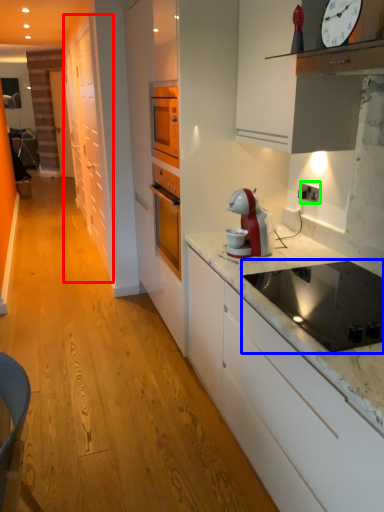
Question: Based on their relative distances, which object is nearer to cabinetry (highlighted by a red box)? Choose from kitchen appliance (highlighted by a blue box) and electric outlet (highlighted by a green box).

Choices:
 (A) kitchen appliance
 (B) electric outlet

Answer: (B)